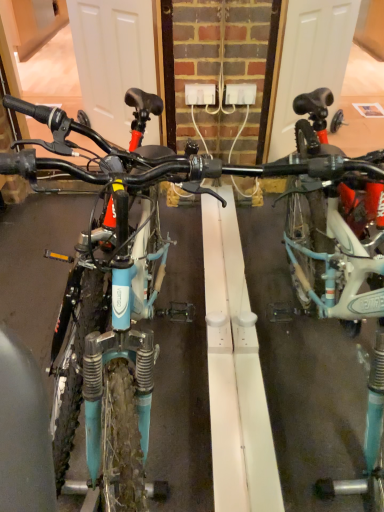
I want to click on black matte garage door at upper center, so click(112, 59).

Image resolution: width=384 pixels, height=512 pixels. Describe the element at coordinates (112, 59) in the screenshot. I see `black matte garage door at upper center` at that location.

Find the location of `black matte garage door at upper center`. black matte garage door at upper center is located at coordinates (112, 59).